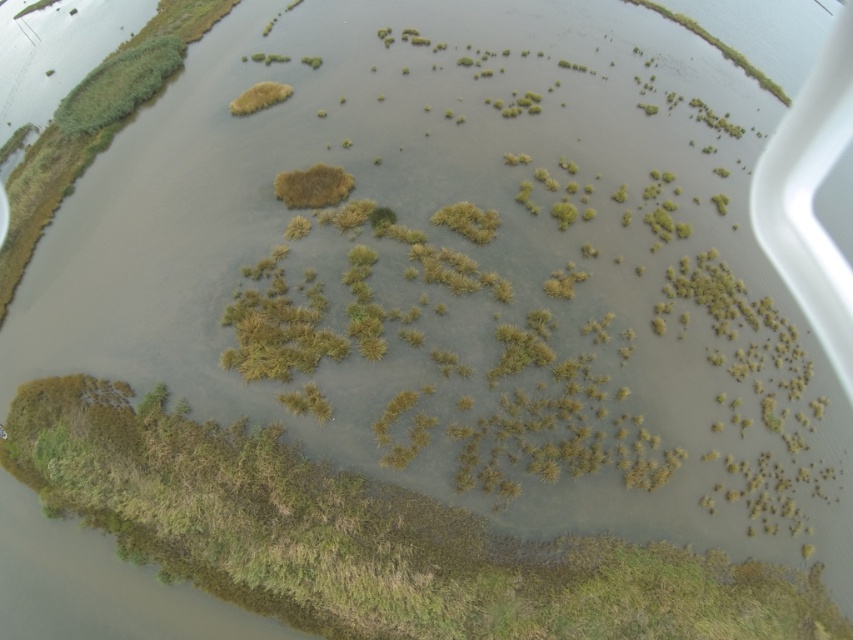
You are a bird flying over the wetland and want to land on the closest vegetation to you. Which one should you choose between the green grass at upper center and the green fuzzy plant at upper center?

The green grass at upper center is closer to you, so you should land there.

You are a drone operator flying over a wetland and need to land your drone safely. The drone requires a flat area of at least 200 feet between two objects to land. Are the green grass at upper center and green fuzzy plant at upper center far enough apart for a safe landing?

The green grass at upper center and green fuzzy plant at upper center are 216.23 feet apart, which is more than the required 200 feet, so the area between them is suitable for a safe drone landing.